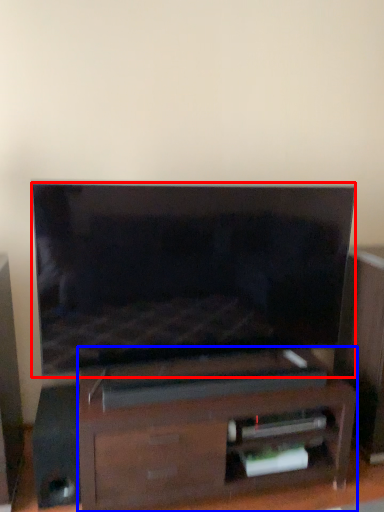
Question: Among these objects, which one is farthest to the camera, television (highlighted by a red box) or furniture (highlighted by a blue box)?

Choices:
 (A) television
 (B) furniture

Answer: (B)